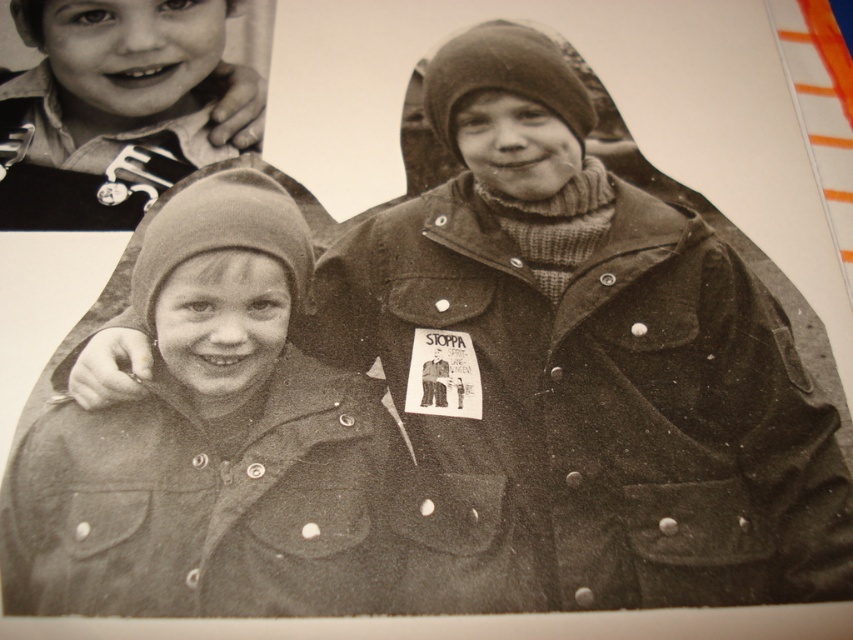
You are a photographer adjusting a camera tripod. The coarse woolen hat at center and the matte black shirt at upper left are in your viewfinder. You need to ensure that both are in focus. Given that the camera has a depth of field that can cover 10 inches, will both objects be in focus?

The coarse woolen hat at center is 10.49 inches away from the matte black shirt at upper left. Since the depth of field can cover 10 inches, the distance between them exceeds this range, so both objects may not be in focus simultaneously.

You are a photographer setting up a camera to capture the scene. The camera has a focus range that can only accommodate objects up to 10 cm in width. You notice the coarse woolen hat at center and the matte black shirt at upper left in your viewfinder. Based on their sizes, can both objects be in focus simultaneously?

The coarse woolen hat at center is wider than the matte black shirt at upper left. Since the camera can only focus on objects up to 10 cm in width, if the hat is wider than 10 cm, it would exceed the focus range. However, the description only states the hat is larger in width than the shirt but doesn

Based on the coordinates provided, which object is located at point (x=212, y=444) in the image?

The coarse woolen hat at center is located at point (x=212, y=444) in the image.